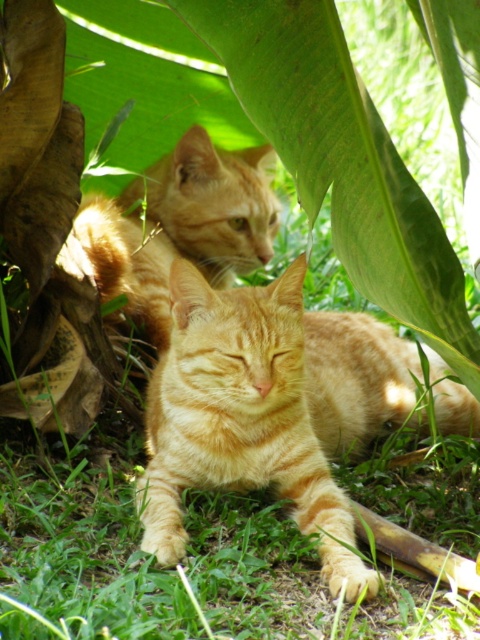
Question: Can you confirm if orange fur cat at center is positioned to the left of orange tabby cat at upper center?

Choices:
 (A) no
 (B) yes

Answer: (A)

Question: Observing the image, what is the correct spatial positioning of orange fur cat at center in reference to orange tabby cat at upper center?

Choices:
 (A) right
 (B) left

Answer: (A)

Question: Which of the following is the closest to the observer?

Choices:
 (A) green leafy at upper center
 (B) orange fur cat at center
 (C) orange tabby cat at upper center

Answer: (A)

Question: Which object is farther from the camera taking this photo?

Choices:
 (A) orange tabby cat at upper center
 (B) orange fur cat at center
 (C) green leafy at upper center

Answer: (A)

Question: Can you confirm if orange fur cat at center is positioned to the left of orange tabby cat at upper center?

Choices:
 (A) yes
 (B) no

Answer: (B)

Question: Which object appears closest to the camera in this image?

Choices:
 (A) orange fur cat at center
 (B) orange tabby cat at upper center
 (C) green leafy at upper center

Answer: (C)